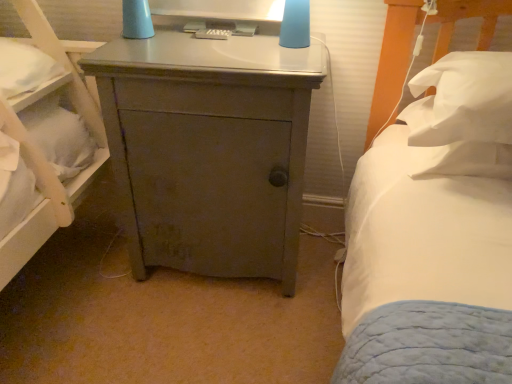
Question: Should I look upward or downward to see white soft pillow at right, placed as the first pillow when sorted from top to bottom?

Choices:
 (A) up
 (B) down

Answer: (A)

Question: From the image's perspective, would you say white soft pillow at right, placed as the first pillow when sorted from top to bottom, is shown under white soft pillow at right, marked as the first pillow in a bottom-to-top arrangement?

Choices:
 (A) yes
 (B) no

Answer: (B)

Question: From a real-world perspective, is white soft pillow at right, placed as the first pillow when sorted from top to bottom, located beneath white soft pillow at right, marked as the first pillow in a bottom-to-top arrangement?

Choices:
 (A) yes
 (B) no

Answer: (B)

Question: Is the position of white soft pillow at right, placed as the first pillow when sorted from top to bottom, less distant than that of white soft pillow at right, which ranks as the second pillow in top-to-bottom order?

Choices:
 (A) yes
 (B) no

Answer: (A)

Question: Is white soft pillow at right, placed as the first pillow when sorted from top to bottom, at the left side of white soft pillow at right, marked as the first pillow in a bottom-to-top arrangement?

Choices:
 (A) no
 (B) yes

Answer: (A)

Question: Is white soft pillow at right, placed as the first pillow when sorted from top to bottom, completely or partially outside of white soft pillow at right, marked as the first pillow in a bottom-to-top arrangement?

Choices:
 (A) no
 (B) yes

Answer: (B)

Question: Can white soft pillow at right, marked as the first pillow in a bottom-to-top arrangement, be found inside white soft pillow at right, placed as the first pillow when sorted from top to bottom?

Choices:
 (A) yes
 (B) no

Answer: (B)

Question: Is white soft pillow at right, placed as the first pillow when sorted from top to bottom, behind matte gray cabinet at center?

Choices:
 (A) no
 (B) yes

Answer: (A)

Question: Considering the relative sizes of white soft pillow at right, positioned as the second pillow in bottom-to-top order, and matte gray cabinet at center in the image provided, is white soft pillow at right, positioned as the second pillow in bottom-to-top order, thinner than matte gray cabinet at center?

Choices:
 (A) no
 (B) yes

Answer: (B)

Question: From a real-world perspective, is white soft pillow at right, placed as the first pillow when sorted from top to bottom, physically below matte gray cabinet at center?

Choices:
 (A) no
 (B) yes

Answer: (A)

Question: Is white soft pillow at right, positioned as the second pillow in bottom-to-top order, located outside matte gray cabinet at center?

Choices:
 (A) no
 (B) yes

Answer: (B)

Question: Considering the relative sizes of white soft pillow at right, positioned as the second pillow in bottom-to-top order, and matte gray cabinet at center in the image provided, is white soft pillow at right, positioned as the second pillow in bottom-to-top order, smaller than matte gray cabinet at center?

Choices:
 (A) no
 (B) yes

Answer: (B)

Question: From a real-world perspective, does white soft pillow at right, positioned as the second pillow in bottom-to-top order, stand above matte gray cabinet at center?

Choices:
 (A) no
 (B) yes

Answer: (B)

Question: Is matte blue lampshade at upper center to the left of white soft pillow at right, which ranks as the second pillow in top-to-bottom order, from the viewer's perspective?

Choices:
 (A) yes
 (B) no

Answer: (A)